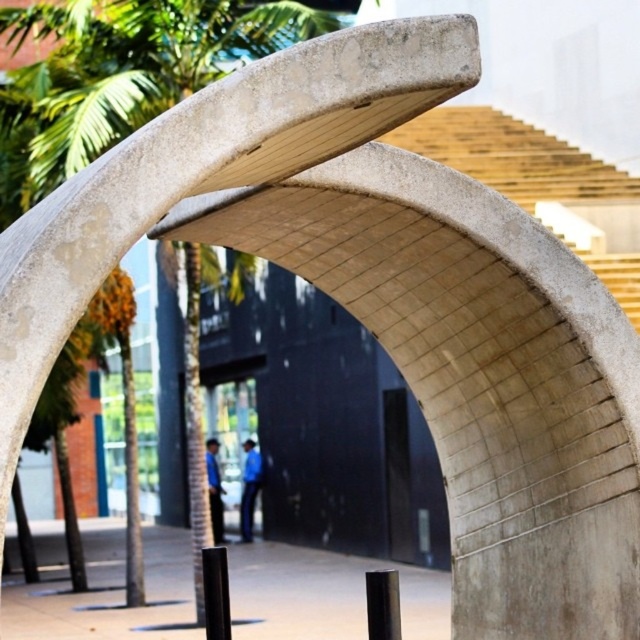
You are standing inside the archway and want to exit to the street. You notice a smooth concrete post at center and blue fabric pants at center. Which object is closer to the exit?

The smooth concrete post at center is to the right of blue fabric pants at center. Since you are facing the exit, the object on the right would be closer to the exit when moving forward. Therefore, the smooth concrete post at center is closer to the exit.